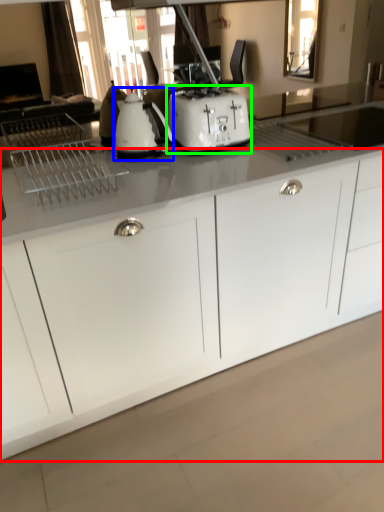
Question: Considering the real-world distances, which object is farthest from cabinetry (highlighted by a red box)? kitchen appliance (highlighted by a blue box) or toaster (highlighted by a green box)?

Choices:
 (A) kitchen appliance
 (B) toaster

Answer: (A)